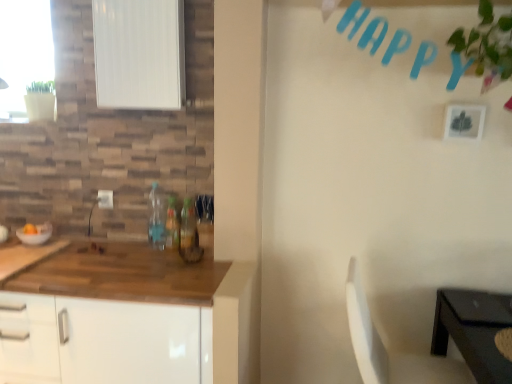
Identify the location of vacant area on top of white matte cabinet at lower left (from a real-world perspective). Image resolution: width=512 pixels, height=384 pixels. (95, 257).